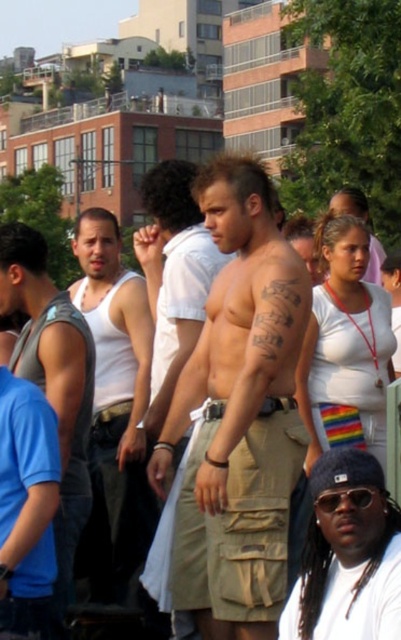
Does point (145, 364) lie in front of point (368, 468)?

That is False.

Which is above, white matte tank top at center or black knit cap at lower right?

white matte tank top at center

The width and height of the screenshot is (401, 640). What do you see at coordinates (115, 406) in the screenshot? I see `white matte tank top at center` at bounding box center [115, 406].

You are a GUI agent. You are given a task and a screenshot of the screen. Output one action in this format:
    pyautogui.click(x=<x>, y=<y>)
    Task: Click on the white matte tank top at center
    The image size is (401, 640).
    Given the screenshot: What is the action you would take?
    pyautogui.click(x=115, y=406)

Between khaki cargo shorts at center and gray sleeveless shirt at left, which one appears on the right side from the viewer's perspective?

Positioned to the right is khaki cargo shorts at center.

Is khaki cargo shorts at center to the left of gray sleeveless shirt at left from the viewer's perspective?

Incorrect, khaki cargo shorts at center is not on the left side of gray sleeveless shirt at left.

Between point (247, 435) and point (58, 403), which one is positioned behind?

Point (58, 403)

Find the location of a particular element. This screenshot has width=401, height=640. khaki cargo shorts at center is located at coordinates (238, 416).

Who is lower down, white matte tank top at center or tan cargo shorts at center?

white matte tank top at center is below.

Can you confirm if white matte tank top at center is taller than tan cargo shorts at center?

Incorrect, white matte tank top at center's height is not larger of tan cargo shorts at center's.

Locate an element on the screen. Image resolution: width=401 pixels, height=640 pixels. white matte tank top at center is located at coordinates (115, 406).